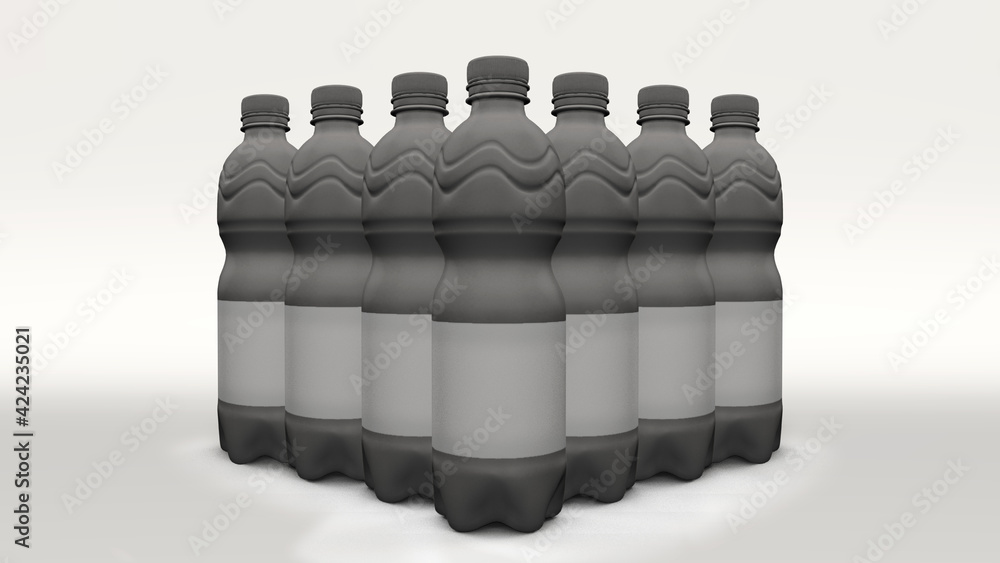
I want to click on bottles, so click(x=251, y=185), click(x=328, y=189), click(x=404, y=182), click(x=484, y=186), click(x=595, y=194), click(x=668, y=194), click(x=754, y=193).